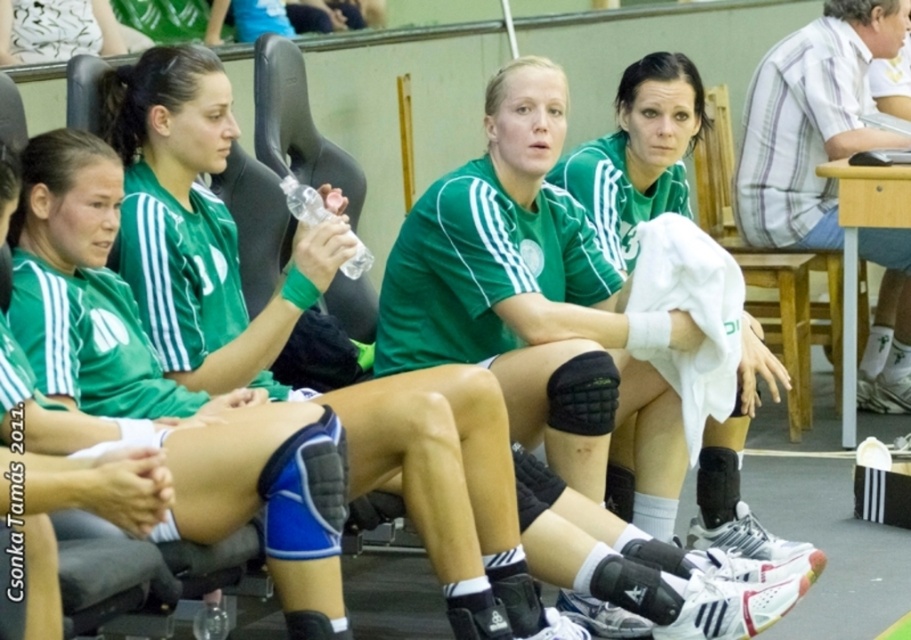
Can you confirm if matte green jersey at center is smaller than matte green uniform at center?

Incorrect, matte green jersey at center is not smaller in size than matte green uniform at center.

Is matte green jersey at center to the left of matte green uniform at center from the viewer's perspective?

Indeed, matte green jersey at center is positioned on the left side of matte green uniform at center.

The width and height of the screenshot is (911, 640). I want to click on matte green jersey at center, so click(x=217, y=241).